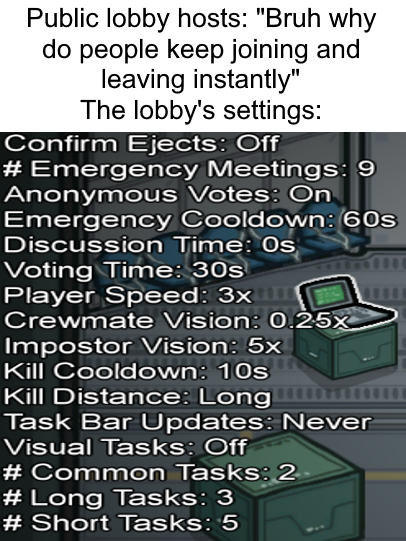
Find the location of a particular element. jump seats is located at coordinates (334, 237), (295, 254), (240, 259), (176, 263), (120, 263).